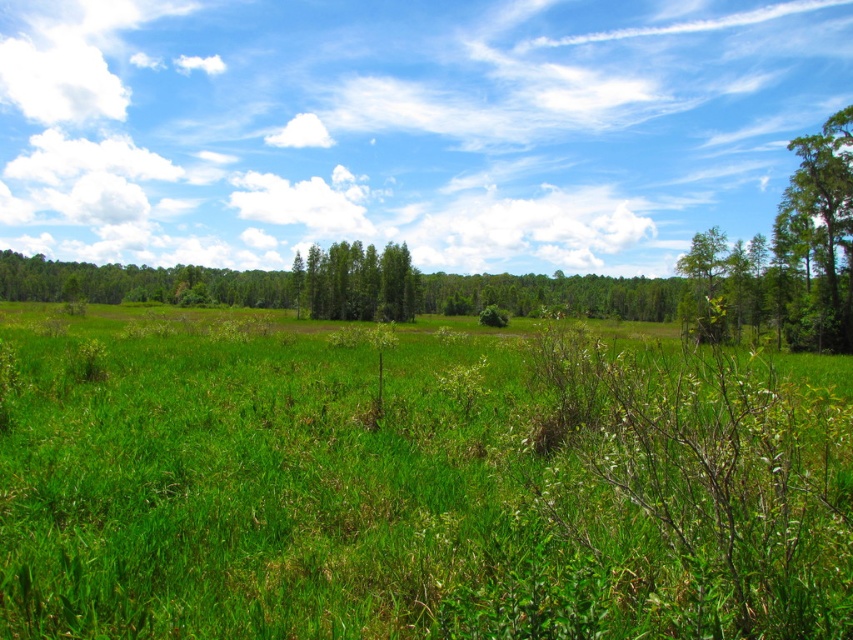
Does green grassy field at center come in front of green leafy tree at right?

Yes, it is in front of green leafy tree at right.

From the picture: Does green grassy field at center appear over green leafy tree at right?

No, green grassy field at center is not above green leafy tree at right.

Find the location of a particular element. The width and height of the screenshot is (853, 640). green grassy field at center is located at coordinates (415, 483).

Does green grassy field at center have a greater width compared to green leafy trees at center?

Correct, the width of green grassy field at center exceeds that of green leafy trees at center.

The height and width of the screenshot is (640, 853). What do you see at coordinates (415, 483) in the screenshot? I see `green grassy field at center` at bounding box center [415, 483].

You are a GUI agent. You are given a task and a screenshot of the screen. Output one action in this format:
    pyautogui.click(x=<x>, y=<y>)
    Task: Click on the green grassy field at center
    The height and width of the screenshot is (640, 853).
    Given the screenshot: What is the action you would take?
    pyautogui.click(x=415, y=483)

Is green leafy tree at right to the left of green leafy trees at center from the viewer's perspective?

In fact, green leafy tree at right is to the right of green leafy trees at center.

I want to click on green leafy tree at right, so point(820,234).

Between point (798, 189) and point (368, 268), which one is positioned behind?

The point (368, 268) is behind.

You are a GUI agent. You are given a task and a screenshot of the screen. Output one action in this format:
    pyautogui.click(x=<x>, y=<y>)
    Task: Click on the green leafy tree at right
    The height and width of the screenshot is (640, 853).
    Given the screenshot: What is the action you would take?
    pyautogui.click(x=820, y=234)